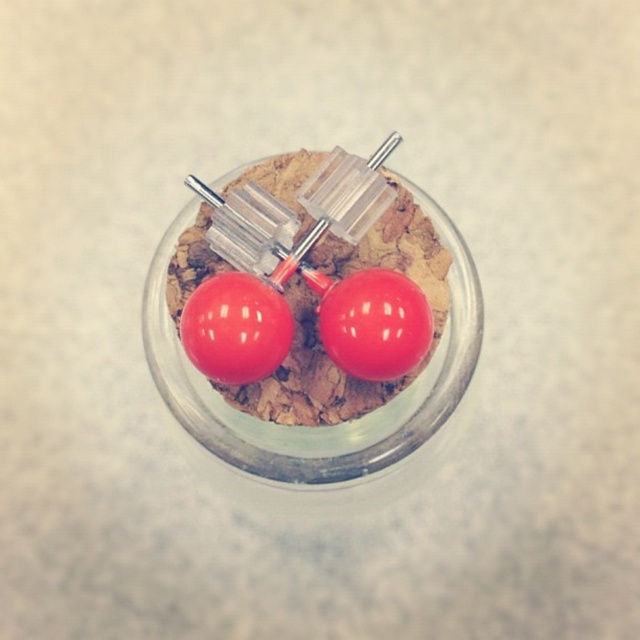
You are a GUI agent. You are given a task and a screenshot of the screen. Output one action in this format:
    pyautogui.click(x=<x>, y=<y>)
    Task: Click on the glossy plastic earrings at center
    This screenshot has height=640, width=640.
    Given the screenshot: What is the action you would take?
    pyautogui.click(x=310, y=380)

Which of these two, glossy plastic earrings at center or glossy plastic cherry at center, stands taller?

glossy plastic earrings at center is taller.

Between point (282, 196) and point (372, 353), which one is positioned behind?

Positioned behind is point (282, 196).

This screenshot has height=640, width=640. Find the location of `glossy plastic earrings at center`. glossy plastic earrings at center is located at coordinates (310, 380).

Consider the image. Can you confirm if glossy plastic earrings at center is smaller than glossy red cherry at center?

Incorrect, glossy plastic earrings at center is not smaller in size than glossy red cherry at center.

Does point (429, 227) come behind point (262, 323)?

Yes, it is behind point (262, 323).

Who is more distant from viewer, (x=385, y=225) or (x=262, y=292)?

The point (x=385, y=225) is behind.

Image resolution: width=640 pixels, height=640 pixels. In order to click on glossy plastic earrings at center in this screenshot , I will do `click(310, 380)`.

Does glossy plastic cherry at center come in front of glossy red cherry at center?

That is True.

Which is more to the left, glossy plastic cherry at center or glossy red cherry at center?

glossy red cherry at center is more to the left.

Which is in front, point (424, 332) or point (208, 333)?

Point (208, 333) is more forward.

I want to click on glossy plastic cherry at center, so click(x=374, y=324).